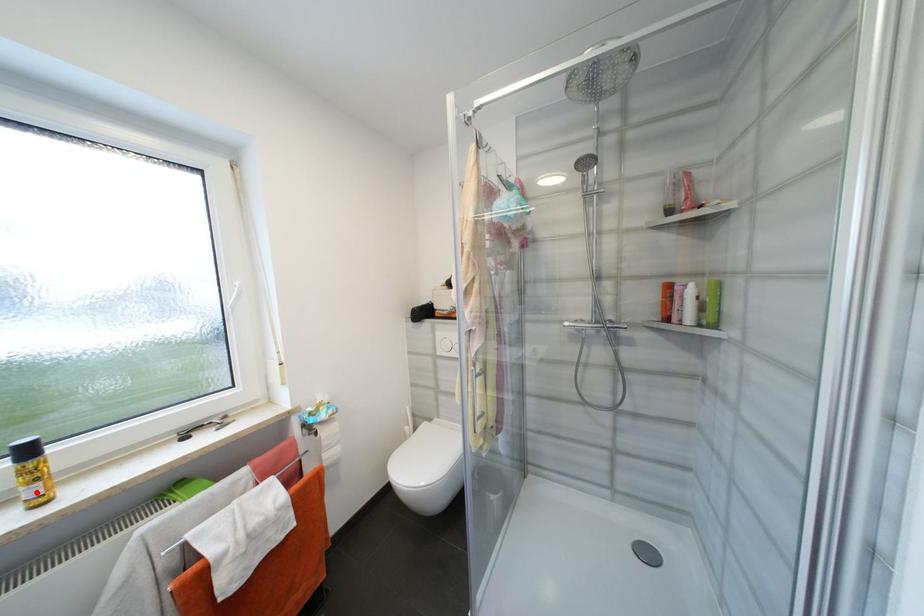
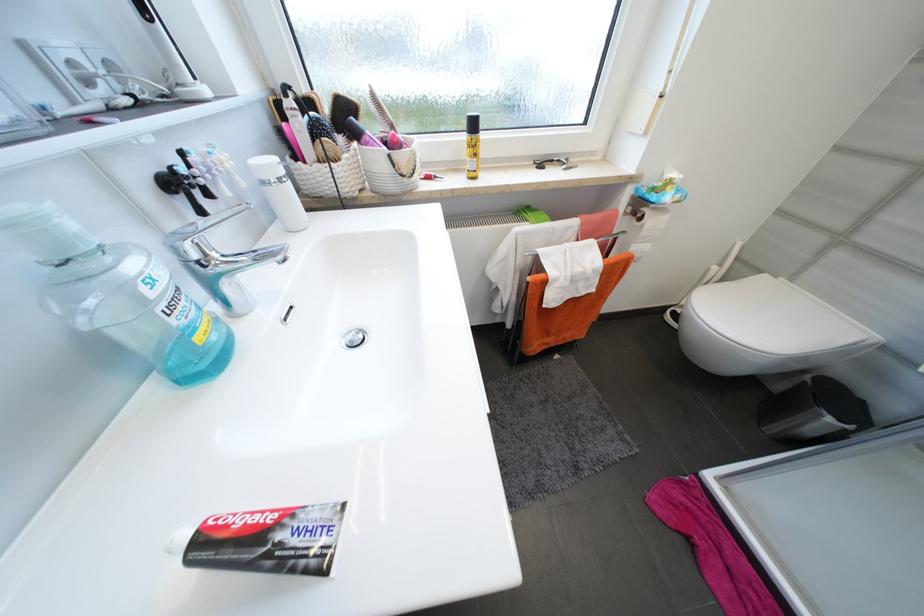
Where in the second image is the point corresponding to the highlighted location from the first image?

(477, 166)